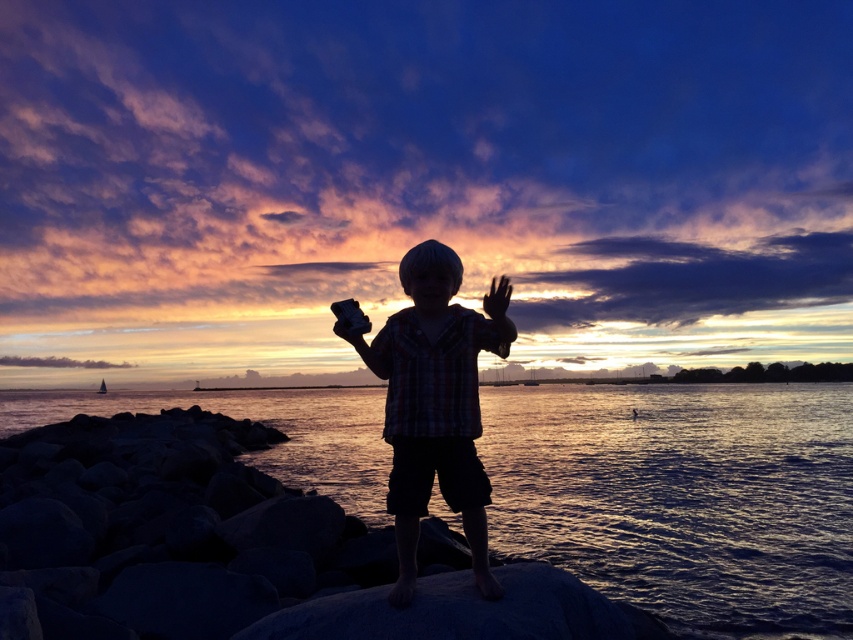
Is point (143, 394) in front of point (341, 332)?

No, it is behind (341, 332).

Based on the photo, does glistening water at center appear under black matte hand at center?

Yes.

From the picture: Who is more distant from viewer, (608, 449) or (339, 324)?

The point (608, 449) is behind.

This screenshot has height=640, width=853. Identify the location of glistening water at center. click(x=683, y=497).

Who is more distant from viewer, (660, 464) or (495, 291)?

Positioned behind is point (660, 464).

Is glistening water at center above silky skin hand at center?

No, glistening water at center is not above silky skin hand at center.

Between point (573, 518) and point (485, 310), which one is positioned in front?

Point (485, 310) is in front.

Locate an element on the screen. Image resolution: width=853 pixels, height=640 pixels. glistening water at center is located at coordinates (683, 497).

Between point (494, 280) and point (347, 337), which one is positioned in front?

Point (494, 280)

Image resolution: width=853 pixels, height=640 pixels. I want to click on silky skin hand at center, so click(497, 298).

The image size is (853, 640). Find the location of `silky skin hand at center`. silky skin hand at center is located at coordinates (497, 298).